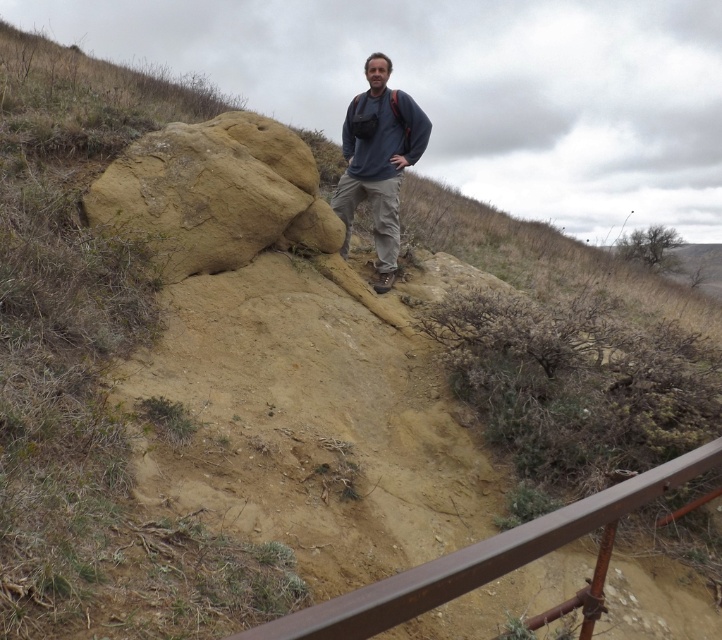
You are a hiker trying to decide whether to climb the sandy beige rock at center or wear the dark blue sweater at center first. Which item is shorter in height?

The sandy beige rock at center is not as tall as the dark blue sweater at center, so the sandy beige rock at center is shorter in height.